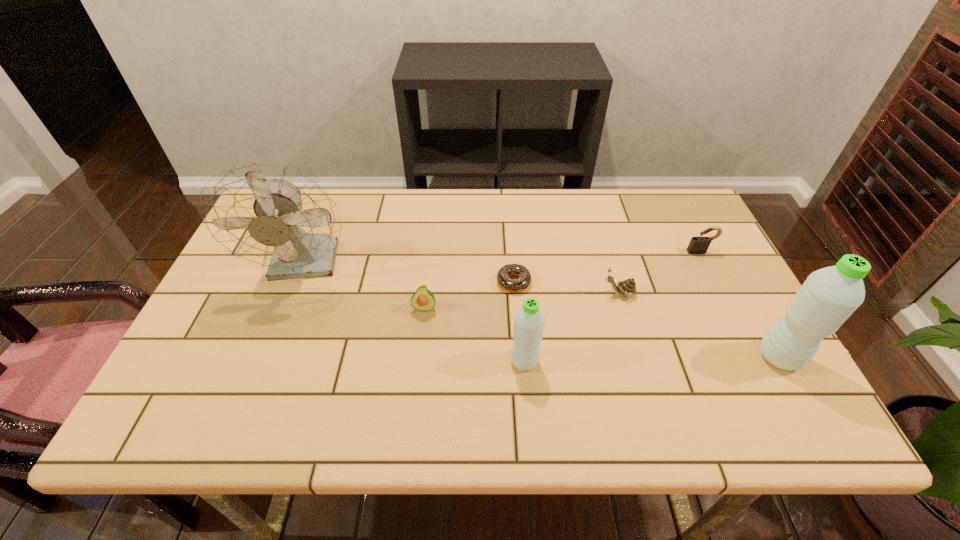
Please point a free position for a water bottle on the left. Please provide its 2D coordinates. Your answer should be formatted as a tuple, i.e. [(x, y)], where the tuple contains the x and y coordinates of a point satisfying the conditions above.

[(265, 366)]